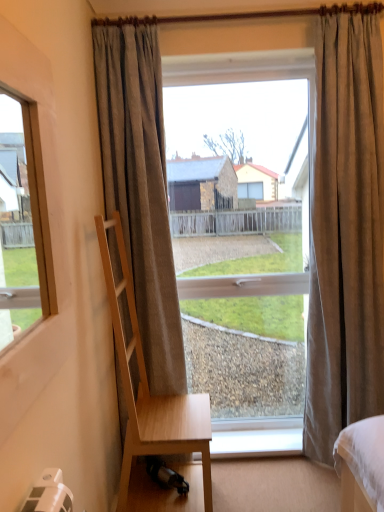
You are a GUI agent. You are given a task and a screenshot of the screen. Output one action in this format:
    pyautogui.click(x=<x>, y=<y>)
    Task: Click on the empty space that is ontop of white plastic window sill at lower center (from a real-world perspective)
    
    Given the screenshot: What is the action you would take?
    pyautogui.click(x=258, y=442)